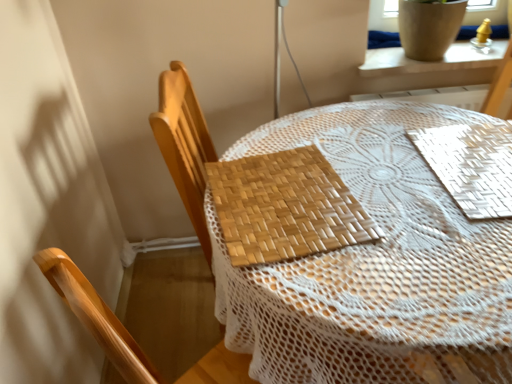
Question: Do you think bamboo placemat at center is within woven wood chair at center, or outside of it?

Choices:
 (A) outside
 (B) inside

Answer: (A)

Question: From the image's perspective, is bamboo placemat at center located above or below woven wood chair at center?

Choices:
 (A) above
 (B) below

Answer: (B)

Question: Which of these objects is positioned farthest from the white ceramic pot at upper right?

Choices:
 (A) woven wood chair at center
 (B) bamboo placemat at center
 (C) white woven mat at upper right, arranged as the second mat when viewed from the left
 (D) woven wood placemat at center, marked as the first mat in a left-to-right arrangement

Answer: (D)

Question: Considering the real-world distances, which object is farthest from the woven wood placemat at center, marked as the first mat in a left-to-right arrangement?

Choices:
 (A) white woven mat at upper right, arranged as the first mat when viewed from the right
 (B) white ceramic pot at upper right
 (C) woven wood chair at center
 (D) bamboo placemat at center

Answer: (B)